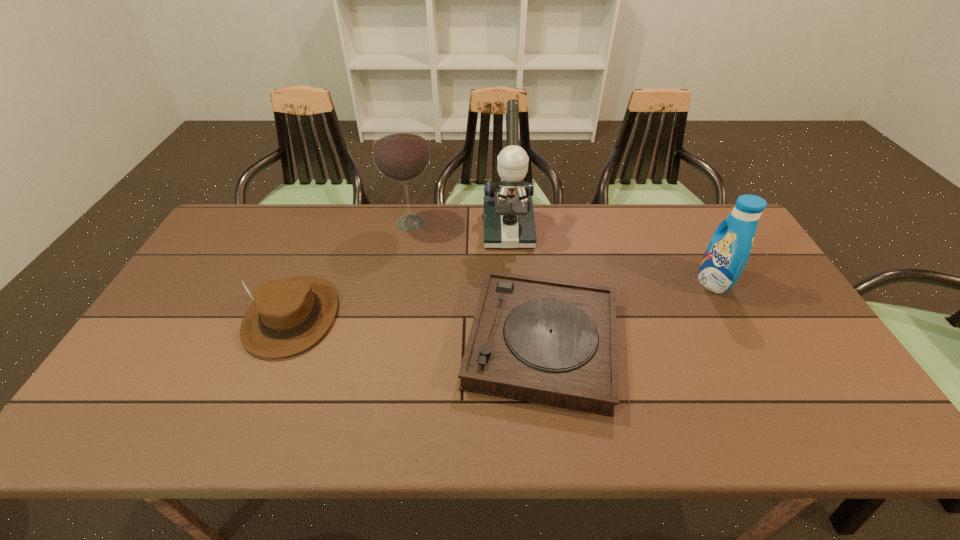
In order to click on vacant position located on the front-facing side of the third tallest object in this screenshot , I will do `click(579, 281)`.

Image resolution: width=960 pixels, height=540 pixels. I want to click on free space located on the front-facing side of the third tallest object, so click(662, 281).

Where is `free space located 0.200m on the feather side of the leftmost object`? The image size is (960, 540). free space located 0.200m on the feather side of the leftmost object is located at coordinates (243, 436).

You are a GUI agent. You are given a task and a screenshot of the screen. Output one action in this format:
    pyautogui.click(x=<x>, y=<y>)
    Task: Click on the free region located 0.320m on the left of the phonograph record
    Image resolution: width=960 pixels, height=540 pixels.
    Given the screenshot: What is the action you would take?
    pyautogui.click(x=337, y=343)

Locate an element on the screen. Image resolution: width=960 pixels, height=540 pixels. microscope that is at the far edge is located at coordinates (509, 223).

Where is `alcohol positioned at the far edge`? The width and height of the screenshot is (960, 540). alcohol positioned at the far edge is located at coordinates (400, 150).

Image resolution: width=960 pixels, height=540 pixels. In order to click on object that is at the near edge in this screenshot , I will do `click(544, 341)`.

The width and height of the screenshot is (960, 540). I want to click on object present at the right edge, so click(x=729, y=248).

This screenshot has width=960, height=540. Find the location of `free space at the far edge of the desktop`. free space at the far edge of the desktop is located at coordinates (308, 233).

You are a GUI agent. You are given a task and a screenshot of the screen. Output one action in this format:
    pyautogui.click(x=<x>, y=<y>)
    Task: Click on the vacant space at the left edge
    The width and height of the screenshot is (960, 540).
    Given the screenshot: What is the action you would take?
    pyautogui.click(x=172, y=304)